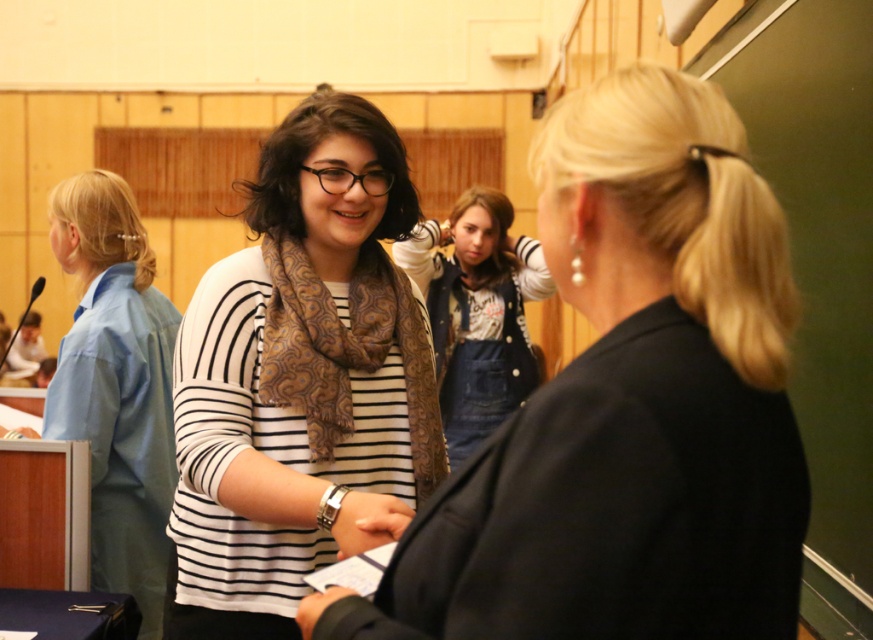
Question: Is blue fabric shirt at left closer to the viewer compared to brown paisley scarf at center?

Choices:
 (A) yes
 (B) no

Answer: (B)

Question: Which point is farther to the camera?

Choices:
 (A) (498, 330)
 (B) (129, 452)
 (C) (383, 387)
 (D) (780, 609)

Answer: (A)

Question: Which of the following is the farthest from the observer?

Choices:
 (A) striped cotton shirt at center
 (B) brown paisley scarf at center
 (C) blue fabric shirt at left

Answer: (C)

Question: Among these objects, which one is nearest to the camera?

Choices:
 (A) denim overalls at center
 (B) striped cotton shirt at center
 (C) brown paisley scarf at center
 (D) striped fabric at center

Answer: (D)

Question: Can you confirm if striped cotton shirt at center is positioned above blue fabric shirt at left?

Choices:
 (A) no
 (B) yes

Answer: (B)

Question: Considering the relative positions of striped fabric at center and brown paisley scarf at center in the image provided, where is striped fabric at center located with respect to brown paisley scarf at center?

Choices:
 (A) right
 (B) left

Answer: (A)